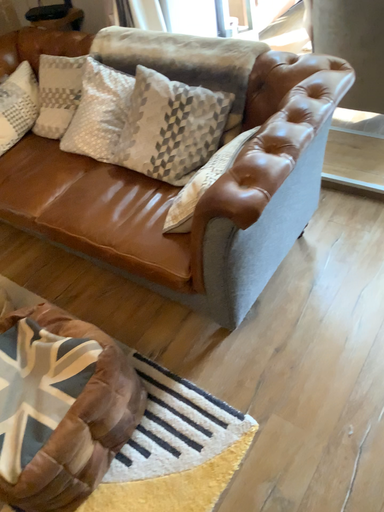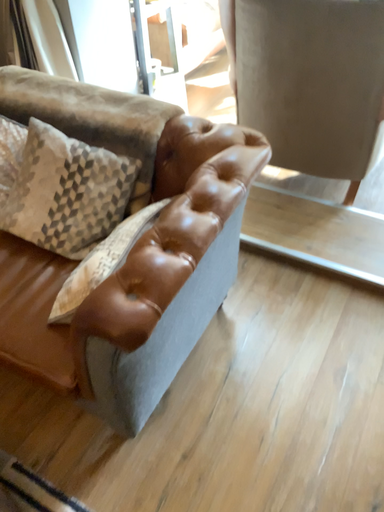
Question: Which way did the camera rotate in the video?

Choices:
 (A) rotated right
 (B) rotated left

Answer: (A)